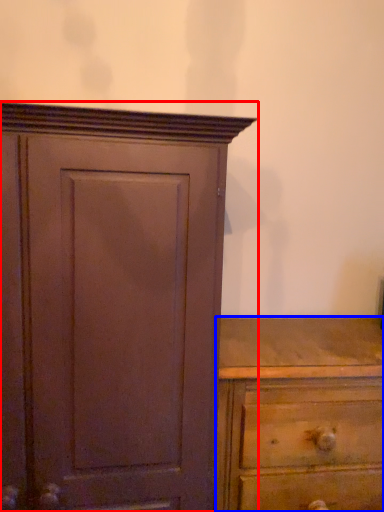
Question: Among these objects, which one is farthest to the camera, cupboard (highlighted by a red box) or chest of drawers (highlighted by a blue box)?

Choices:
 (A) cupboard
 (B) chest of drawers

Answer: (B)